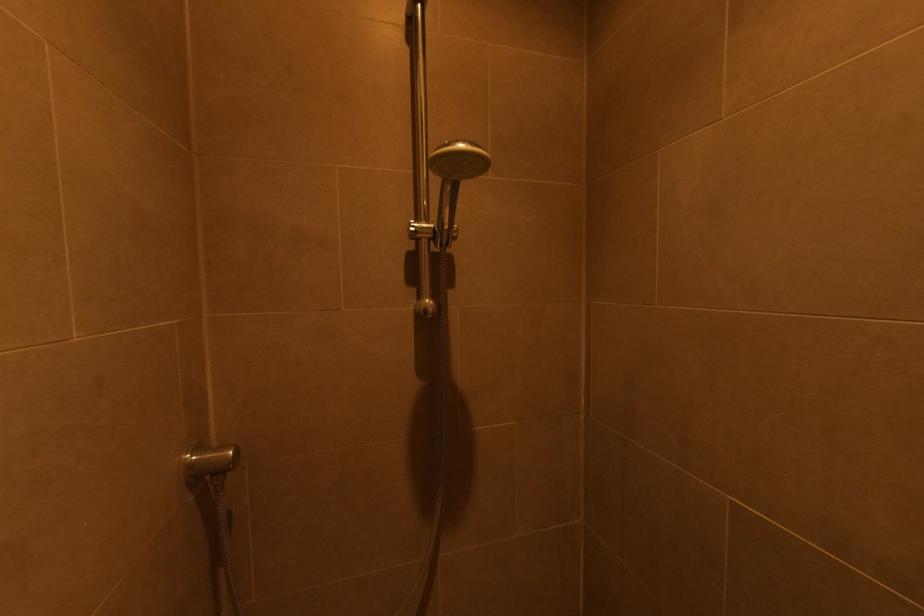
Find the location of a particular element. shower holder adjuster is located at coordinates (208, 464).